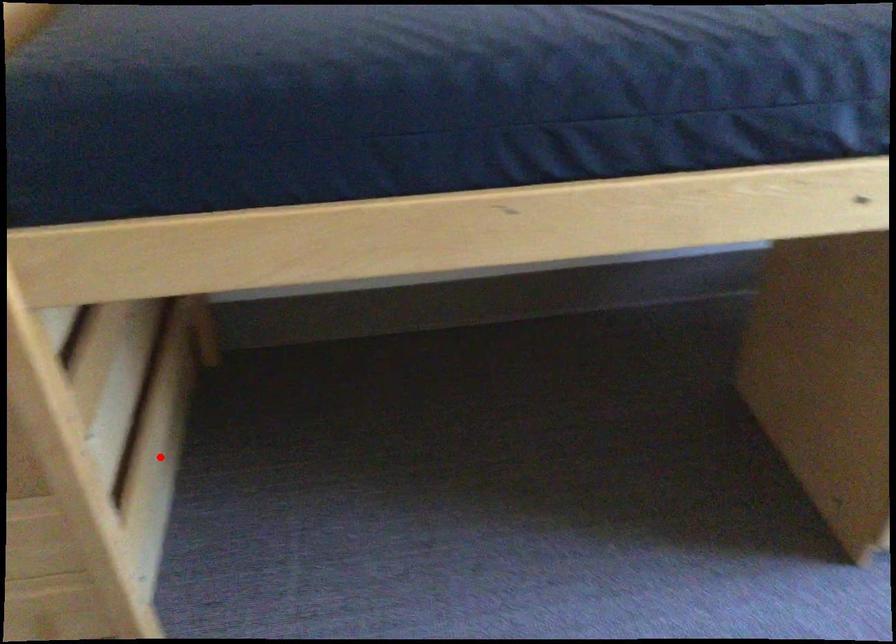
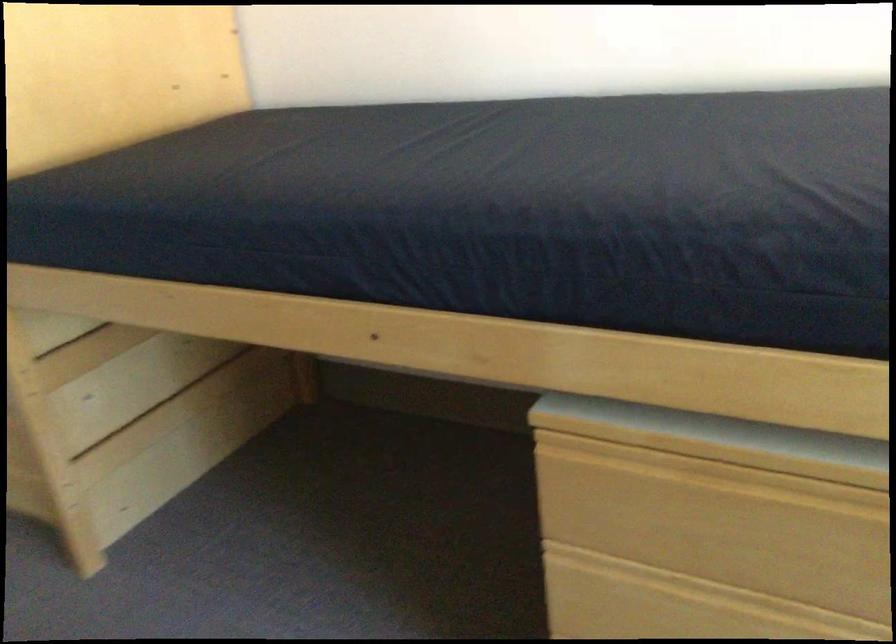
The point at the highlighted location is marked in the first image. Where is the corresponding point in the second image?

(195, 444)